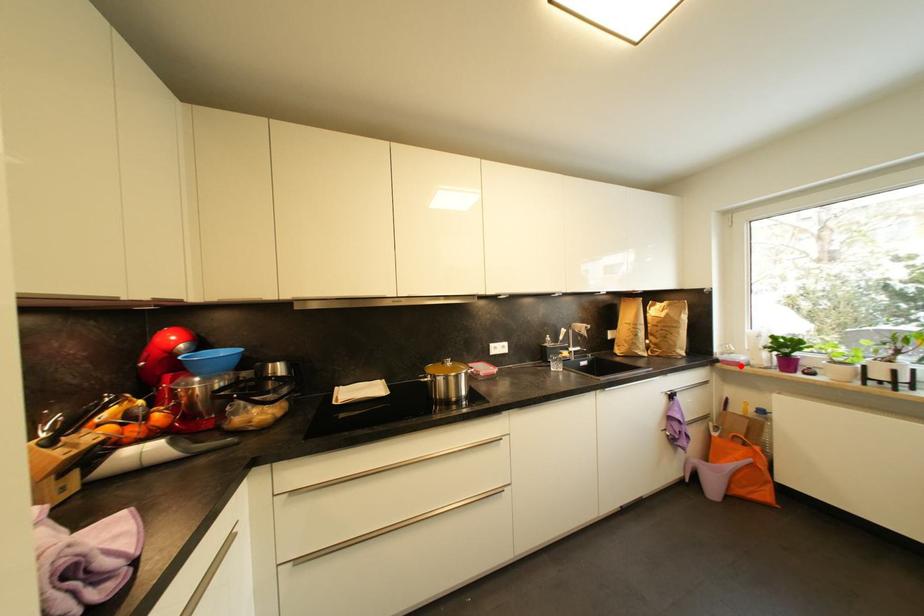
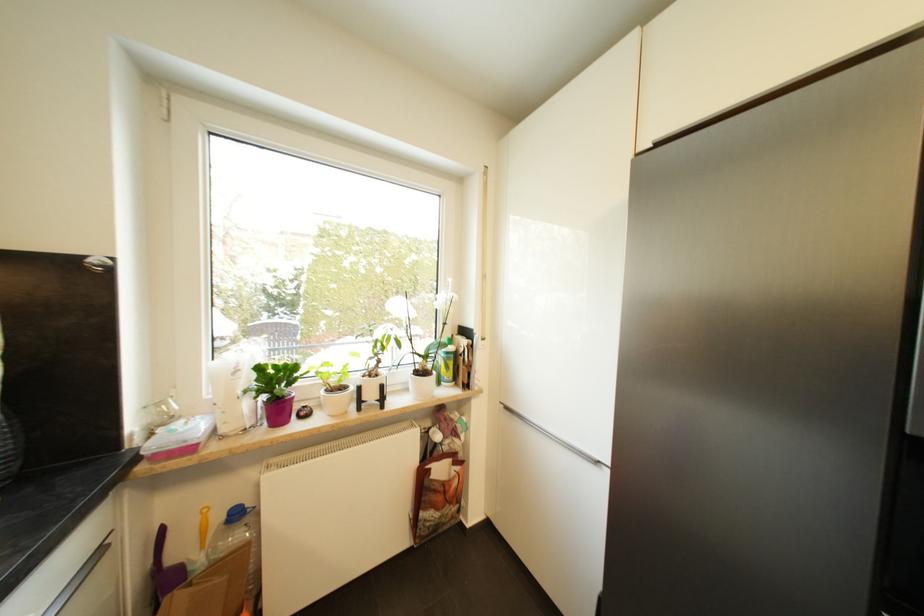
Find the pixel in the second image that matches the highlighted location in the first image.

(195, 451)